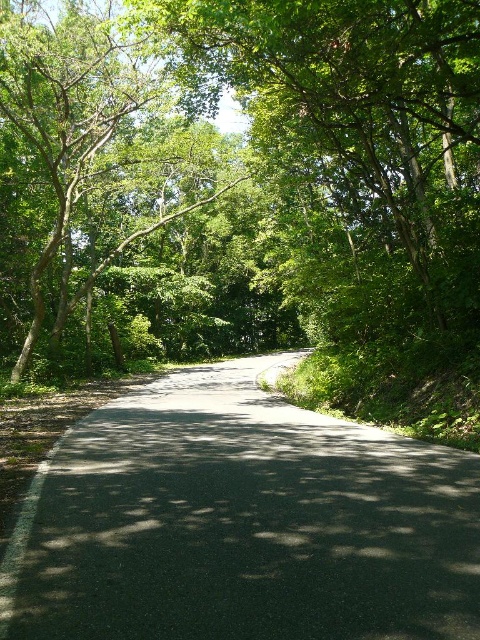
Does point (31, 618) come closer to viewer compared to point (74, 100)?

That is True.

Is black asphalt road at center smaller than green leafy tree at upper left?

Yes, black asphalt road at center is smaller than green leafy tree at upper left.

Identify the location of black asphalt road at center. (243, 522).

I want to click on black asphalt road at center, so click(x=243, y=522).